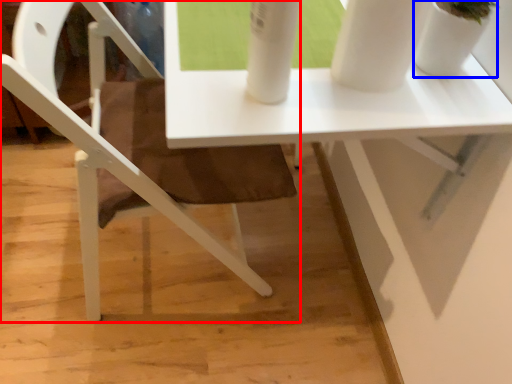
Question: Which point is closer to the camera, chair (highlighted by a red box) or glass vase (highlighted by a blue box)?

Choices:
 (A) chair
 (B) glass vase

Answer: (B)